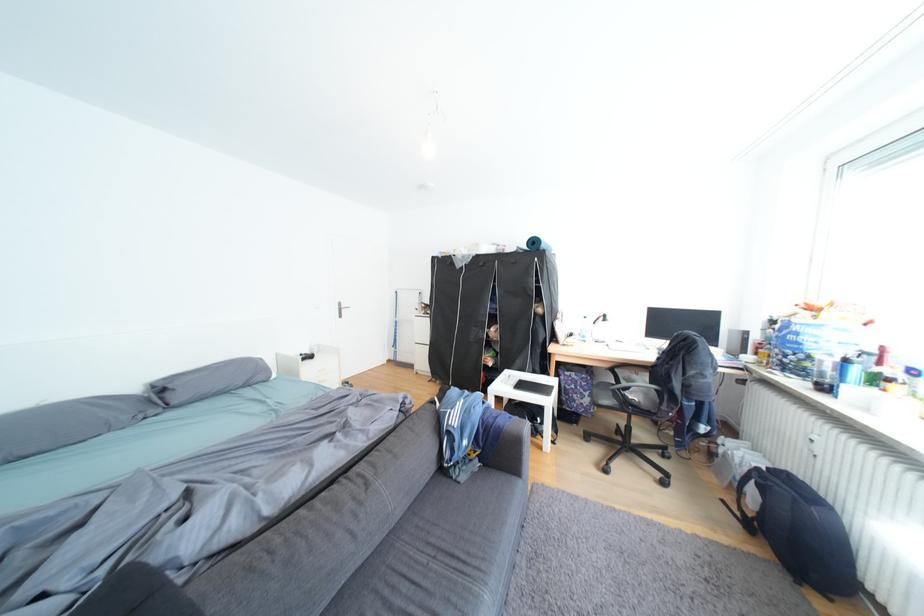
The height and width of the screenshot is (616, 924). In order to click on grey sofa armrest in this screenshot , I will do `click(490, 432)`.